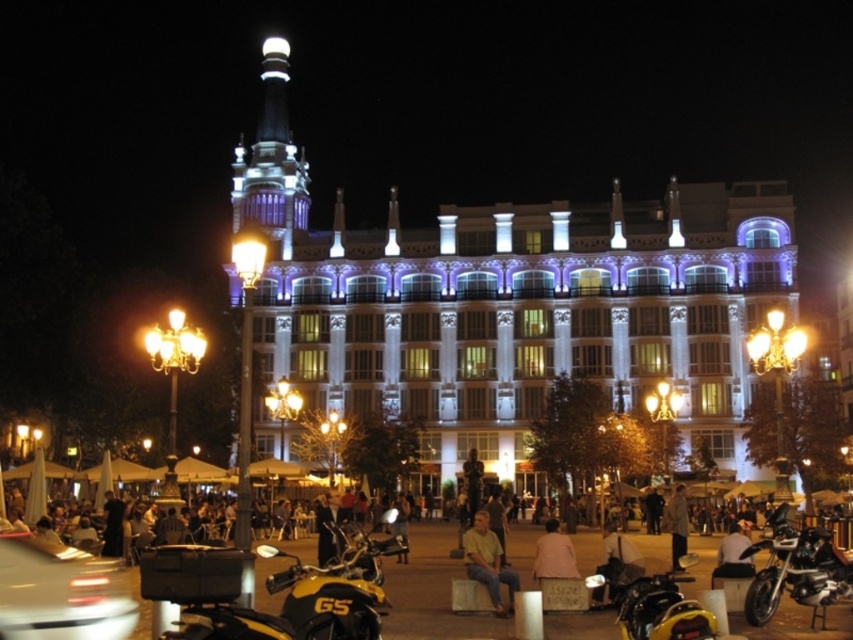
Question: Which of these objects is positioned closest to the light brown leather jacket at lower center?

Choices:
 (A) yellow matte motorcycle at lower left
 (B) light brown fabric shirt at center
 (C) yellow matte motorcycle at lower center
 (D) shiny black motorcycle at lower right

Answer: (C)

Question: Observing the image, what is the correct spatial positioning of shiny black motorcycle at lower right in reference to light brown leather jacket at lower center?

Choices:
 (A) above
 (B) below

Answer: (A)

Question: Does yellow matte motorcycle at lower left have a greater width compared to light brown leather jacket at center?

Choices:
 (A) no
 (B) yes

Answer: (B)

Question: Which point is closer to the camera taking this photo?

Choices:
 (A) 196,593
 (B) 640,605

Answer: (A)

Question: Does light brown fabric shirt at center appear on the right side of light brown leather jacket at center?

Choices:
 (A) no
 (B) yes

Answer: (A)

Question: Estimate the real-world distances between objects in this image. Which object is closer to the yellow matte motorcycle at lower center?

Choices:
 (A) yellow matte motorcycle at lower left
 (B) shiny black motorcycle at lower right
 (C) light brown leather jacket at center
 (D) light brown leather jacket at lower center

Answer: (D)